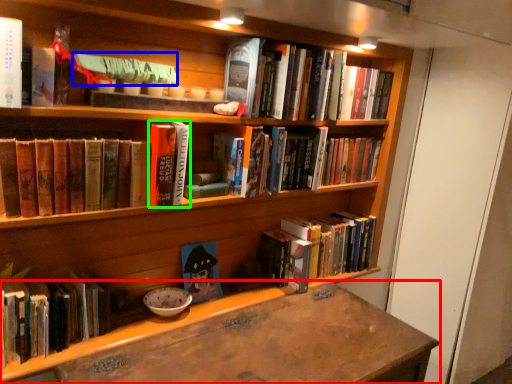
Question: Based on their relative distances, which object is farther from desk (highlighted by a red box)? Choose from book (highlighted by a blue box) and book (highlighted by a green box).

Choices:
 (A) book
 (B) book

Answer: (A)